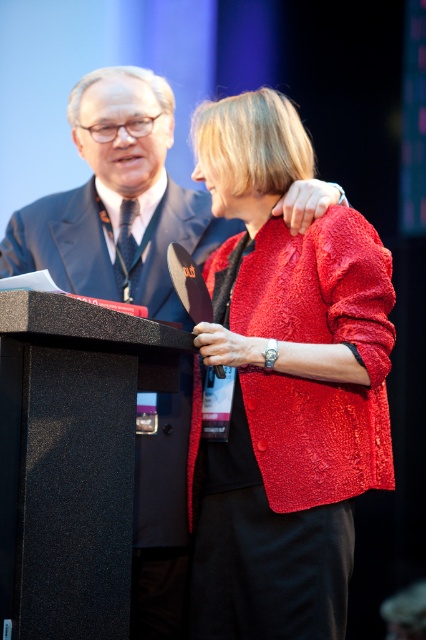
Does black textured podium at center appear under matte black suit at center?

Indeed, black textured podium at center is positioned under matte black suit at center.

Which is below, black textured podium at center or matte black suit at center?

black textured podium at center

Describe the element at coordinates (80, 458) in the screenshot. I see `black textured podium at center` at that location.

Image resolution: width=426 pixels, height=640 pixels. In order to click on black textured podium at center in this screenshot , I will do `click(80, 458)`.

Which of these two, red textured jacket at center or matte black suit at center, stands shorter?

Standing shorter between the two is red textured jacket at center.

Measure the distance between red textured jacket at center and camera.

They are 5.37 feet apart.

I want to click on red textured jacket at center, so click(x=285, y=385).

Does red textured jacket at center have a greater height compared to black textured podium at center?

Yes, red textured jacket at center is taller than black textured podium at center.

Between point (365, 330) and point (66, 602), which one is positioned in front?

Point (66, 602) is in front.

You are a GUI agent. You are given a task and a screenshot of the screen. Output one action in this format:
    pyautogui.click(x=<x>, y=<y>)
    Task: Click on the red textured jacket at center
    The image size is (426, 640).
    Given the screenshot: What is the action you would take?
    pyautogui.click(x=285, y=385)